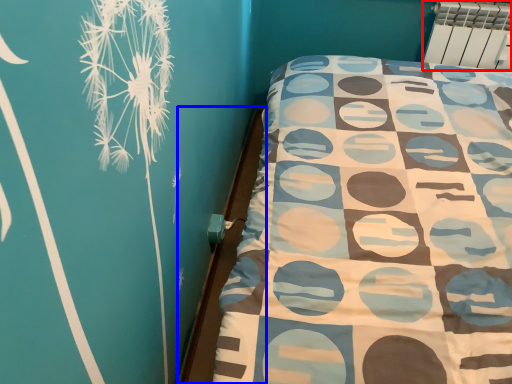
Question: Which object appears farthest to the camera in this image, radiator (highlighted by a red box) or bed frame (highlighted by a blue box)?

Choices:
 (A) radiator
 (B) bed frame

Answer: (A)